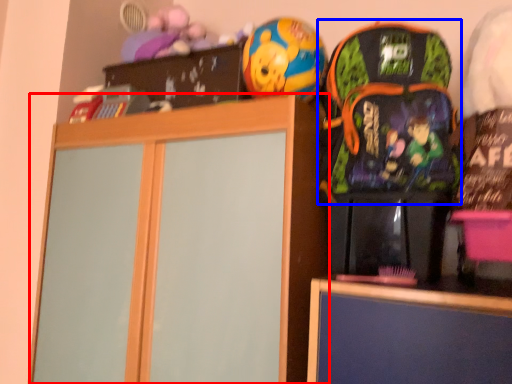
Question: Among these objects, which one is nearest to the camera, cabinetry (highlighted by a red box) or backpack (highlighted by a blue box)?

Choices:
 (A) cabinetry
 (B) backpack

Answer: (B)